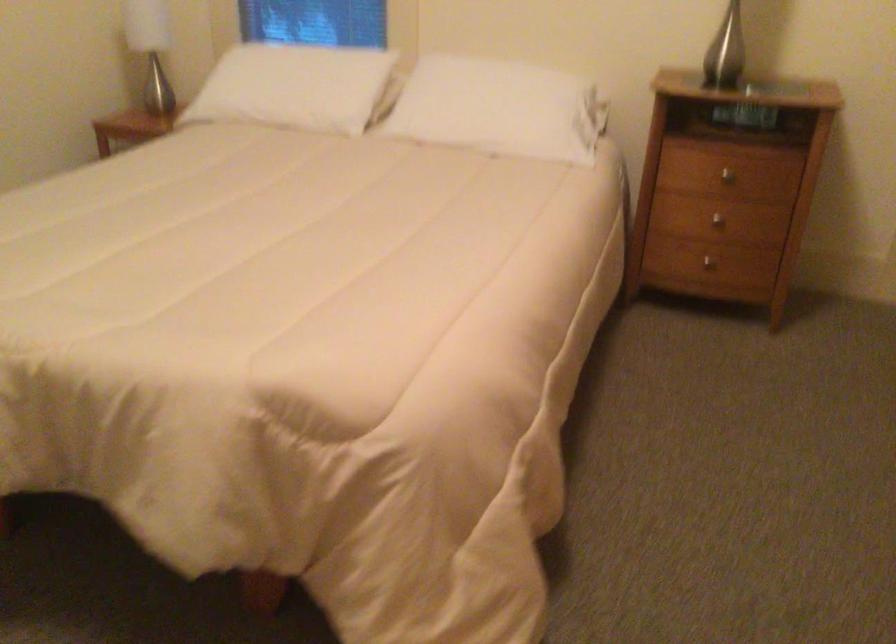
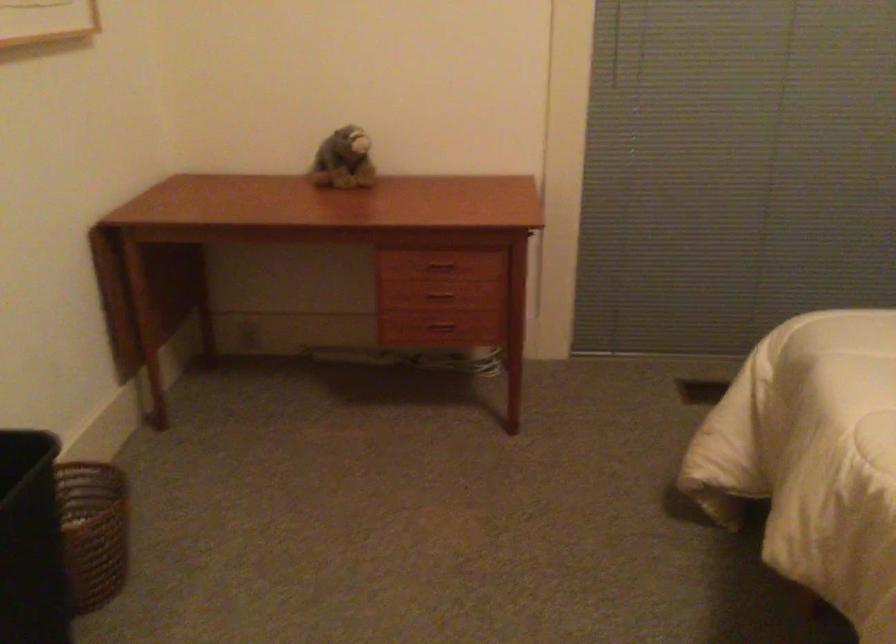
Question: The camera is either moving clockwise (left) or counter-clockwise (right) around the object. The first image is from the beginning of the video and the second image is from the end. Is the camera moving left or right when shooting the video?

Choices:
 (A) Left
 (B) Right

Answer: (B)